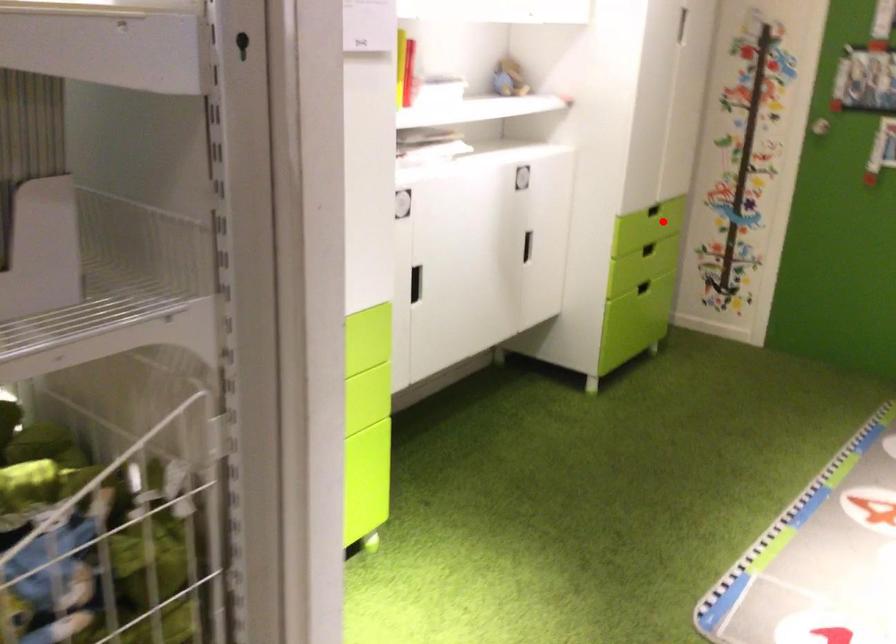
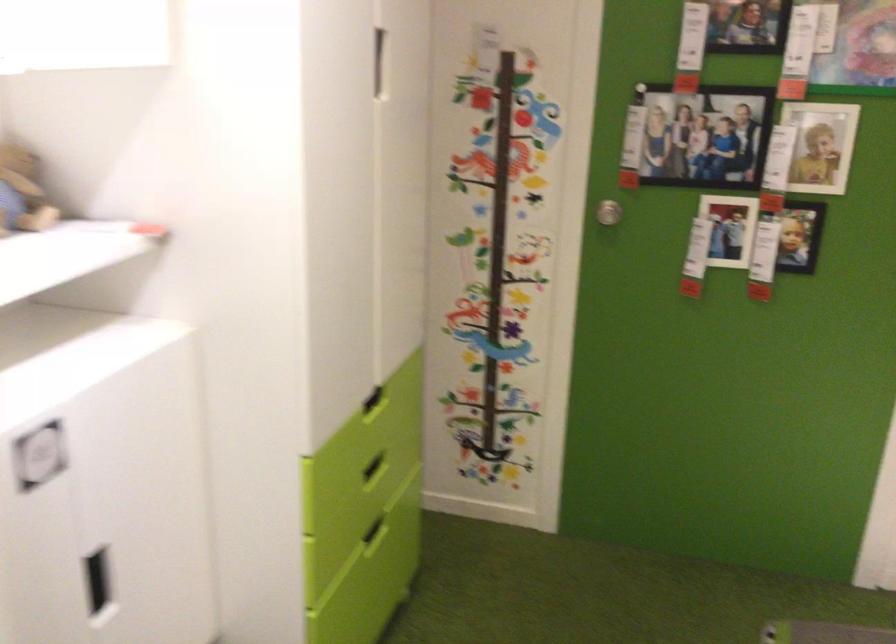
Question: I am providing you with two images of the same scene from different viewpoints. Image1 has a red point marked. In image2, the corresponding 3D location appears at what relative position? Reply with the corresponding letter.

Choices:
 (A) Closer
 (B) Farther

Answer: (A)